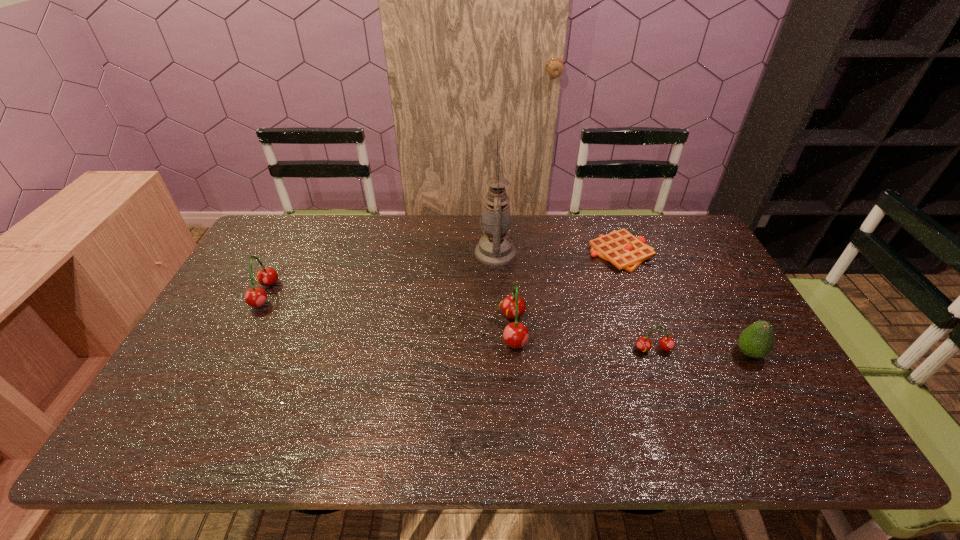
You are a GUI agent. You are given a task and a screenshot of the screen. Output one action in this format:
    pyautogui.click(x=<x>, y=<y>)
    Task: Click on the object that is at the right edge
    
    Given the screenshot: What is the action you would take?
    pyautogui.click(x=756, y=341)

Locate an element on the screen. This screenshot has width=960, height=540. free region at the far edge of the desktop is located at coordinates (418, 241).

This screenshot has height=540, width=960. In the image, there is a desktop. What are the coordinates of `vacant space at the near edge` in the screenshot? It's located at (473, 402).

You are a GUI agent. You are given a task and a screenshot of the screen. Output one action in this format:
    pyautogui.click(x=<x>, y=<y>)
    Task: Click on the free region at the left edge
    This screenshot has width=960, height=540.
    Given the screenshot: What is the action you would take?
    pyautogui.click(x=219, y=354)

Locate an element on the screen. This screenshot has height=540, width=960. blank space at the far right corner of the desktop is located at coordinates (691, 226).

Find the location of a particular element. This screenshot has height=540, width=960. free space at the near right corner is located at coordinates (774, 401).

I want to click on vacant space that's between the second shortest cherry and the tallest object, so click(380, 273).

Locate an element on the screen. free space that is in between the shortest cherry and the rightmost object is located at coordinates (701, 352).

This screenshot has height=540, width=960. I want to click on free space between the waffle and the third shortest object, so click(685, 303).

Image resolution: width=960 pixels, height=540 pixels. Identify the location of free spot between the oil lamp and the shortest object. (559, 253).